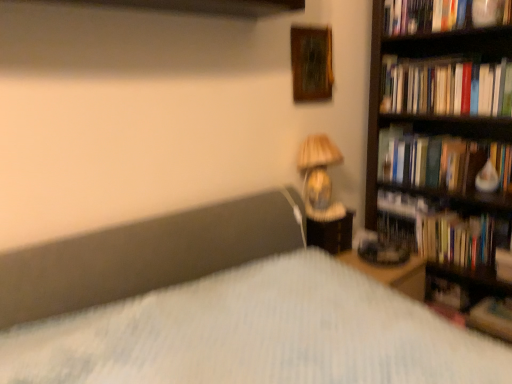
Question: From the image's perspective, is matte beige lampshade at upper right beneath hardcover book at right, which appears as the fourth book when viewed from the top?

Choices:
 (A) no
 (B) yes

Answer: (A)

Question: Does matte beige lampshade at upper right have a greater width compared to hardcover book at right, positioned as the 1th book in bottom-to-top order?

Choices:
 (A) yes
 (B) no

Answer: (B)

Question: Does matte beige lampshade at upper right have a larger size compared to hardcover book at right, which appears as the fourth book when viewed from the top?

Choices:
 (A) yes
 (B) no

Answer: (A)

Question: Is matte beige lampshade at upper right not close to hardcover book at right, positioned as the 1th book in bottom-to-top order?

Choices:
 (A) no
 (B) yes

Answer: (A)

Question: Is matte beige lampshade at upper right outside of hardcover book at right, positioned as the 1th book in bottom-to-top order?

Choices:
 (A) yes
 (B) no

Answer: (A)

Question: Does matte beige lampshade at upper right have a lesser width compared to hardcover book at right, positioned as the 1th book in bottom-to-top order?

Choices:
 (A) yes
 (B) no

Answer: (A)

Question: Is matte plastic nightstand at right further to camera compared to hardcover book at right, positioned as the 1th book in bottom-to-top order?

Choices:
 (A) no
 (B) yes

Answer: (A)

Question: Does matte plastic nightstand at right have a greater width compared to hardcover book at right, positioned as the 1th book in bottom-to-top order?

Choices:
 (A) no
 (B) yes

Answer: (A)

Question: Is matte plastic nightstand at right with hardcover book at right, positioned as the 1th book in bottom-to-top order?

Choices:
 (A) yes
 (B) no

Answer: (B)

Question: Is matte plastic nightstand at right surrounding hardcover book at right, positioned as the 1th book in bottom-to-top order?

Choices:
 (A) no
 (B) yes

Answer: (A)

Question: Considering the relative sizes of matte plastic nightstand at right and hardcover book at right, positioned as the 1th book in bottom-to-top order, in the image provided, is matte plastic nightstand at right taller than hardcover book at right, positioned as the 1th book in bottom-to-top order,?

Choices:
 (A) no
 (B) yes

Answer: (B)

Question: From the image's perspective, is matte plastic nightstand at right located above hardcover book at right, positioned as the 1th book in bottom-to-top order?

Choices:
 (A) no
 (B) yes

Answer: (B)

Question: Considering the relative sizes of hardcover book at upper right, which is the fourth book from bottom to top, and hardcover books at right, the second book viewed from the top, in the image provided, is hardcover book at upper right, which is the fourth book from bottom to top, thinner than hardcover books at right, the second book viewed from the top,?

Choices:
 (A) no
 (B) yes

Answer: (A)